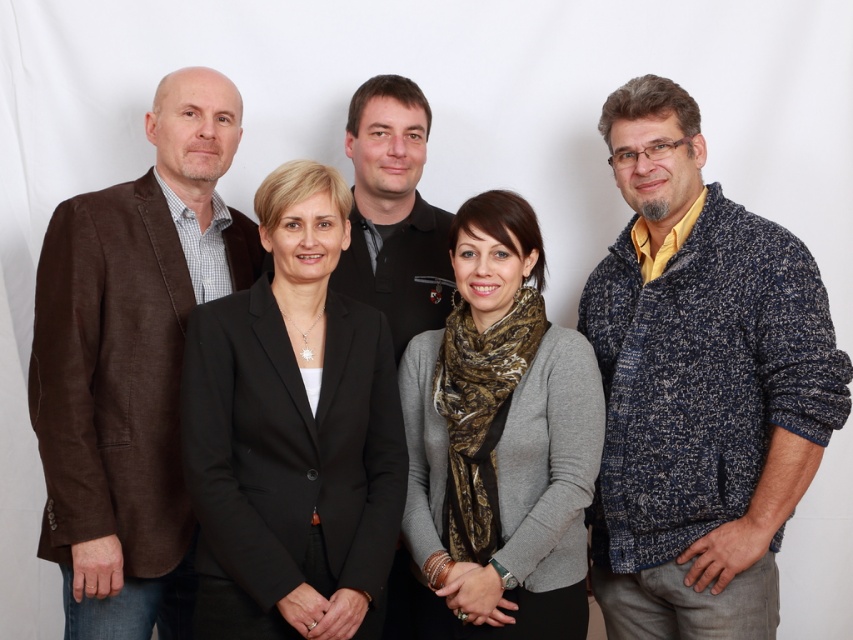
Question: Does knitted blue sweater at right have a greater width compared to brown linen blazer at left?

Choices:
 (A) no
 (B) yes

Answer: (B)

Question: Based on their relative distances, which object is nearer to the gray textured scarf at center?

Choices:
 (A) brown linen blazer at left
 (B) black matte blazer at center

Answer: (B)

Question: Which point is farther to the camera?

Choices:
 (A) black matte shirt at center
 (B) gray textured scarf at center
 (C) black matte blazer at center

Answer: (A)

Question: Considering the relative positions of black matte blazer at center and black matte shirt at center in the image provided, where is black matte blazer at center located with respect to black matte shirt at center?

Choices:
 (A) right
 (B) left

Answer: (B)

Question: Can you confirm if brown linen blazer at left is thinner than gray textured scarf at center?

Choices:
 (A) yes
 (B) no

Answer: (A)

Question: Which of the following is the closest to the observer?

Choices:
 (A) click(x=631, y=182)
 (B) click(x=520, y=605)

Answer: (B)